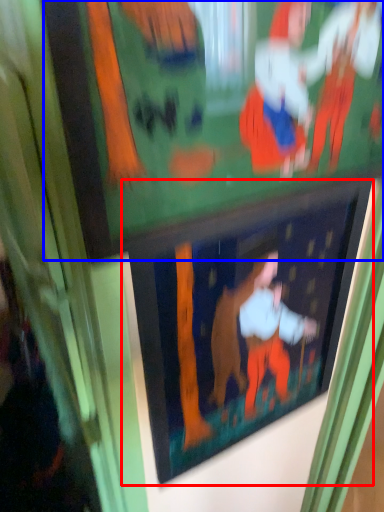
Question: Among these objects, which one is farthest to the camera, picture frame (highlighted by a red box) or bulletin board (highlighted by a blue box)?

Choices:
 (A) picture frame
 (B) bulletin board

Answer: (A)